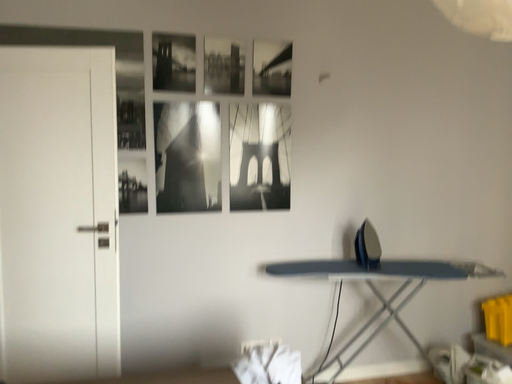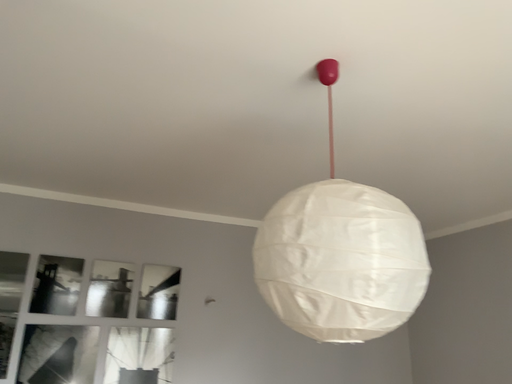
Question: How did the camera likely rotate when shooting the video?

Choices:
 (A) rotated upward
 (B) rotated downward

Answer: (A)